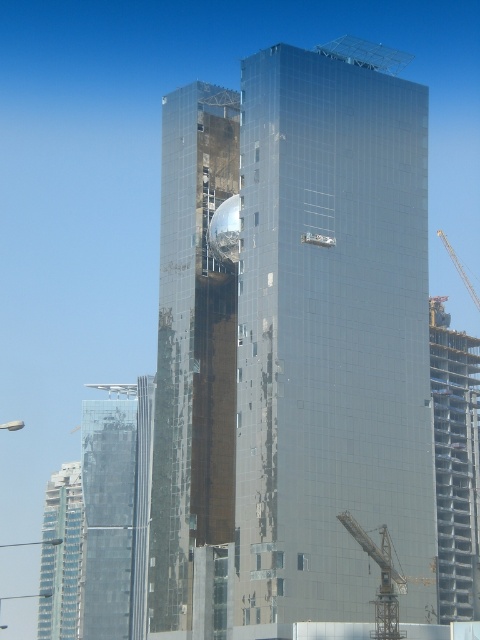
The width and height of the screenshot is (480, 640). What do you see at coordinates (330, 330) in the screenshot?
I see `glossy glass building at center` at bounding box center [330, 330].

Who is positioned more to the right, glossy glass building at center or transparent glass tower at center?

Positioned to the right is glossy glass building at center.

The image size is (480, 640). What do you see at coordinates (330, 330) in the screenshot?
I see `glossy glass building at center` at bounding box center [330, 330].

Where is `glossy glass building at center`? The image size is (480, 640). glossy glass building at center is located at coordinates (330, 330).

Between point (349, 170) and point (468, 486), which one is positioned behind?

Positioned behind is point (468, 486).

What do you see at coordinates (330, 330) in the screenshot? The height and width of the screenshot is (640, 480). I see `glossy glass building at center` at bounding box center [330, 330].

This screenshot has height=640, width=480. I want to click on glossy glass building at center, so click(x=330, y=330).

Between point (479, 444) and point (55, 564), which one is positioned behind?

Point (55, 564)

Can you confirm if metallic glass building at right is bigger than clear glass building at lower left?

Yes.

Who is more forward, (434, 301) or (48, 545)?

Positioned in front is point (434, 301).

At what (x,y) coordinates should I click in order to perform the action: click on metallic glass building at right. Please return your answer as a coordinate pair (x, y). Image resolution: width=480 pixels, height=640 pixels. Looking at the image, I should click on click(x=455, y=465).